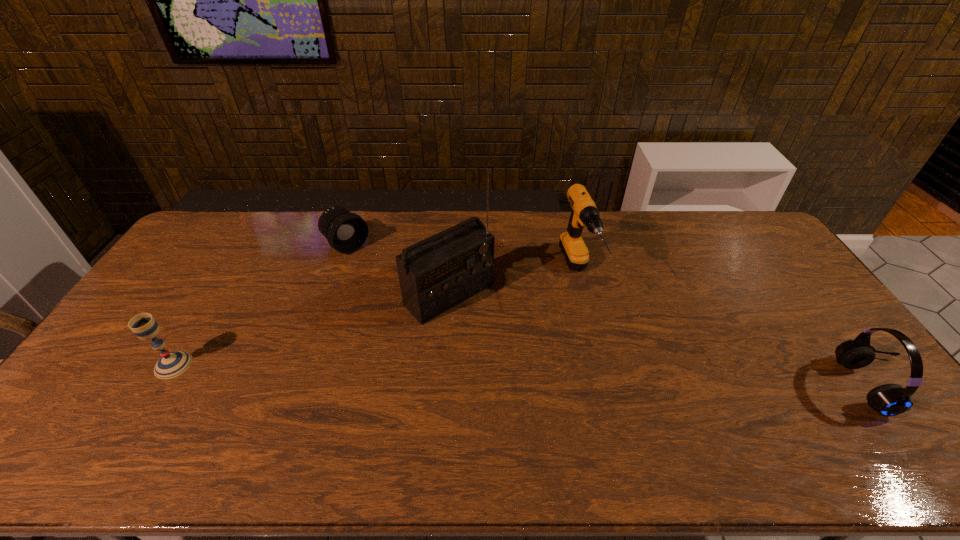
You are a GUI agent. You are given a task and a screenshot of the screen. Output one action in this format:
    pyautogui.click(x=<x>, y=<y>)
    Task: Click on the vacant space located 0.200m on the front panel of the third object from right to left
    
    Given the screenshot: What is the action you would take?
    pyautogui.click(x=522, y=361)

Where is `vacant space located on the front panel of the third object from right to left`? The height and width of the screenshot is (540, 960). vacant space located on the front panel of the third object from right to left is located at coordinates (535, 373).

Image resolution: width=960 pixels, height=540 pixels. In order to click on vacant area located at the front element of the second object from left to right in this screenshot , I will do `click(402, 293)`.

This screenshot has width=960, height=540. In order to click on vacant space situated at the front element of the second object from left to right in this screenshot , I will do `click(420, 308)`.

Locate an element on the screen. Image resolution: width=960 pixels, height=540 pixels. blank space located at the front element of the second object from left to right is located at coordinates (399, 290).

Find the location of a particular element. vacant space located 0.080m at the tip of the drill is located at coordinates (595, 329).

The width and height of the screenshot is (960, 540). In order to click on vacant area situated at the tip of the drill in this screenshot , I will do `click(598, 335)`.

What are the coordinates of `free space located 0.330m at the tip of the drill` in the screenshot? It's located at (629, 404).

At what (x,y) coordinates should I click in order to perform the action: click on telephoto lens that is at the far edge. Please return your answer as a coordinate pair (x, y). Looking at the image, I should click on (346, 232).

The width and height of the screenshot is (960, 540). I want to click on drill that is at the far edge, so (584, 213).